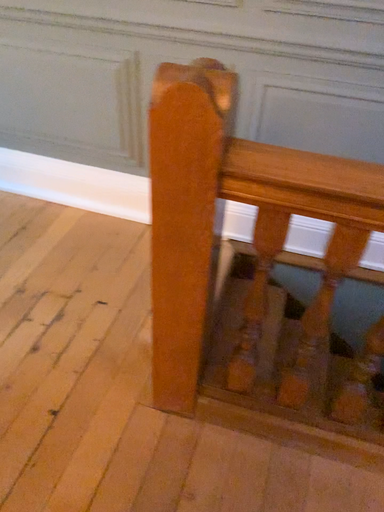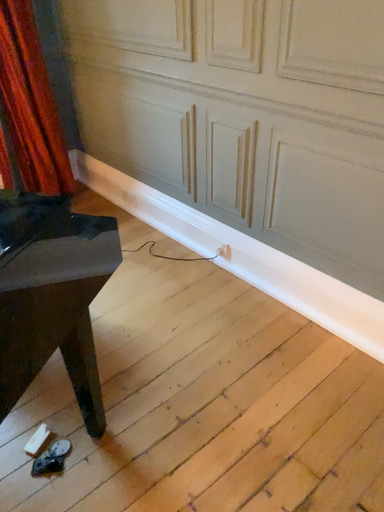
Question: Which way did the camera rotate in the video?

Choices:
 (A) rotated upward
 (B) rotated downward

Answer: (A)